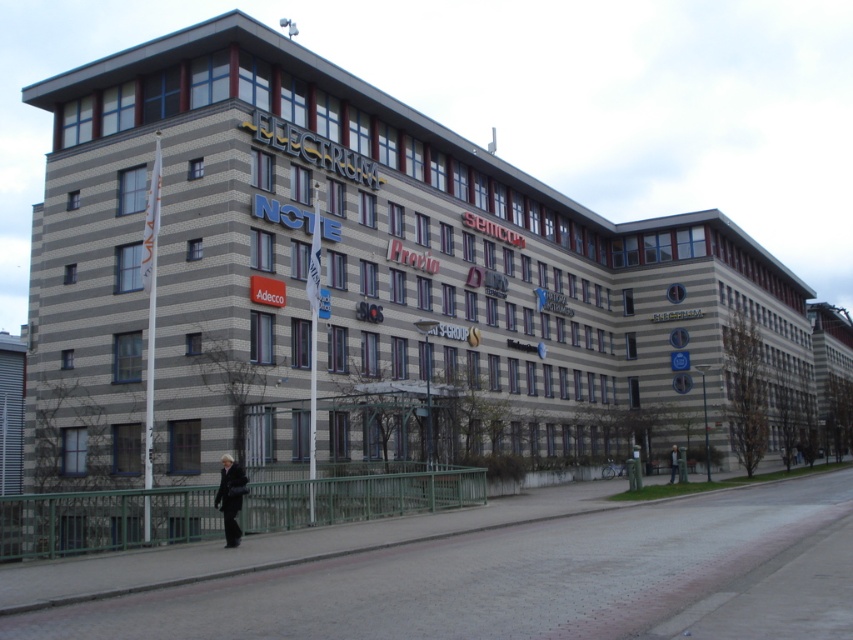
You are standing at the entrance of the building and want to greet the person wearing the black leather coat at lower center. In which direction should you walk from the entrance to reach them?

The black leather coat at lower center is located at point 0.778 on the x axis and 0.271 on the y axis. Since the entrance is typically at the front of the building, you should walk towards the lower center direction to reach the person wearing the black leather coat at lower center.